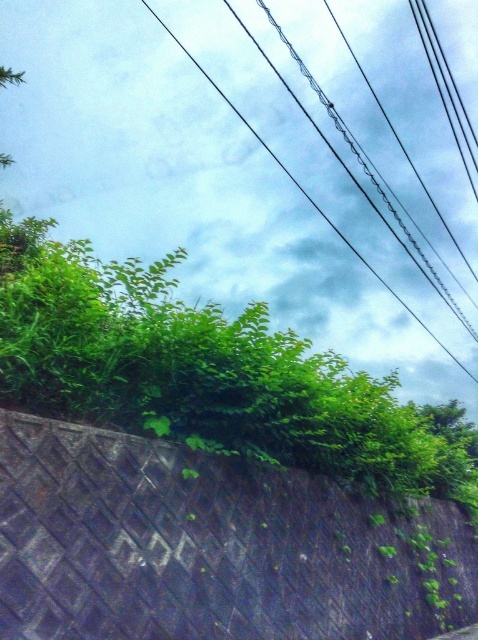
You are a delivery drone that needs to fly from the dark gray textured ramp at lower left to the black wire at upper center. Considering the height difference between them, will you have to ascend or descend during your flight?

The dark gray textured ramp at lower left has a lesser height compared to black wire at upper center, so you will have to ascend to reach the black wire at upper center from the dark gray textured ramp at lower left.

You are a delivery person trying to navigate a narrow path. You see the dark gray textured ramp at lower left and the black wire at upper center. Which object is smaller in size?

The dark gray textured ramp at lower left is smaller in size compared to the black wire at upper center according to the description.

You are a delivery person trying to navigate a narrow path. You see a dark gray textured ramp at lower left and a black wire at upper center. Which object is positioned more to the left side of the image?

The dark gray textured ramp at lower left is positioned more to the left side of the image than the black wire at upper center.